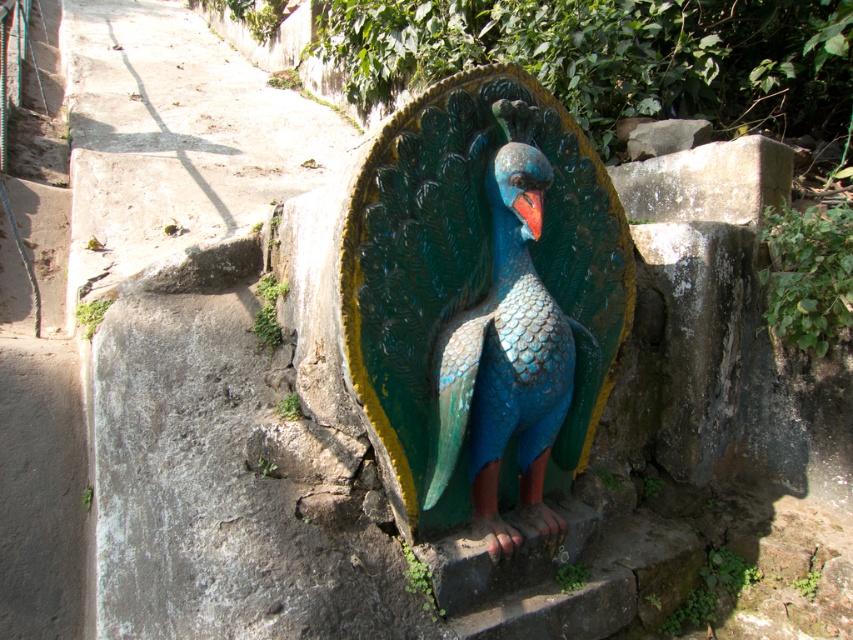
Question: Which of the following is the farthest from the observer?

Choices:
 (A) (560, 346)
 (B) (514, 205)

Answer: (B)

Question: Considering the relative positions of shiny painted peacock at center and shiny red beak at center in the image provided, where is shiny painted peacock at center located with respect to shiny red beak at center?

Choices:
 (A) above
 (B) below

Answer: (B)

Question: Does shiny painted peacock at center appear under shiny red beak at center?

Choices:
 (A) yes
 (B) no

Answer: (A)

Question: Can you confirm if shiny painted peacock at center is positioned to the left of shiny red beak at center?

Choices:
 (A) yes
 (B) no

Answer: (A)